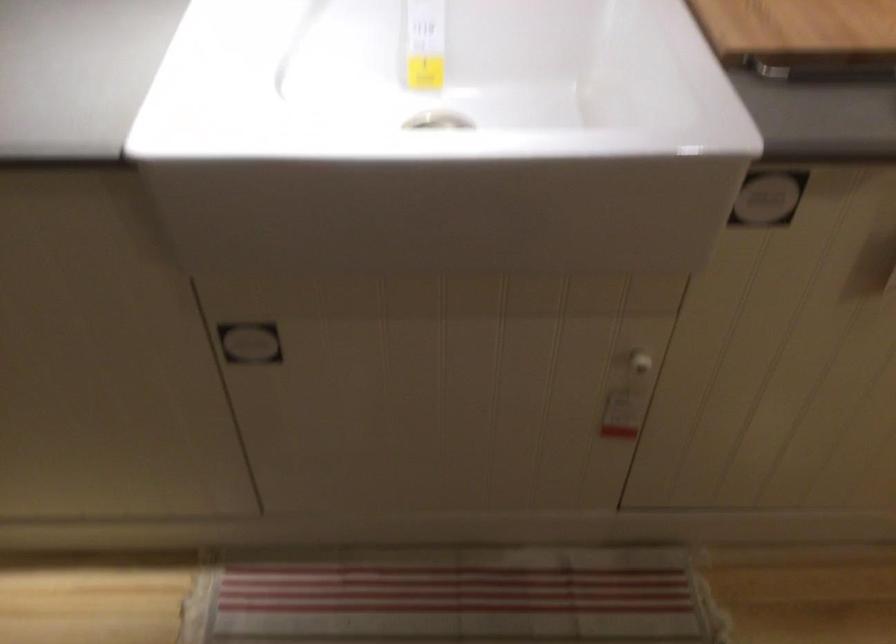
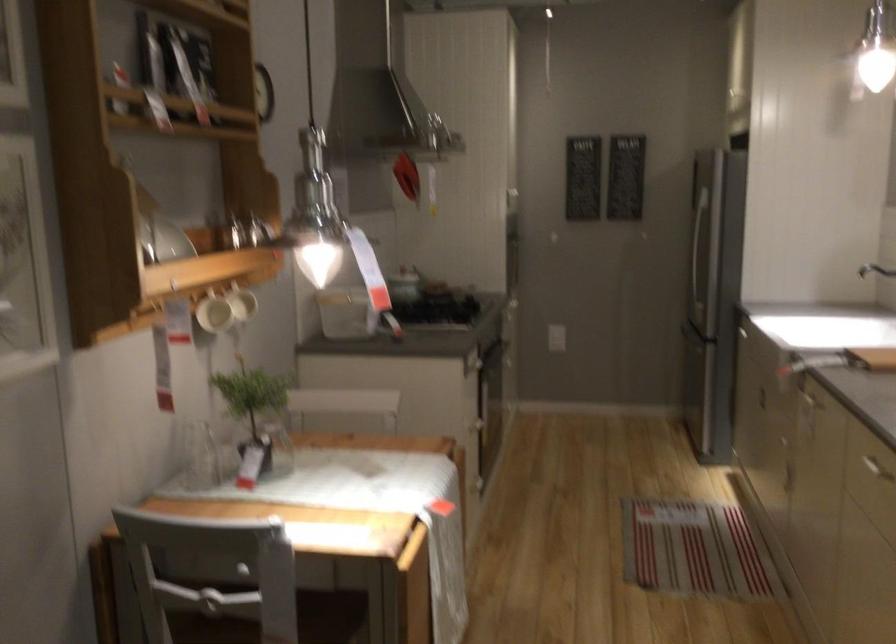
Where in the second image is the point corresponding to (817,243) from the first image?

(810, 391)